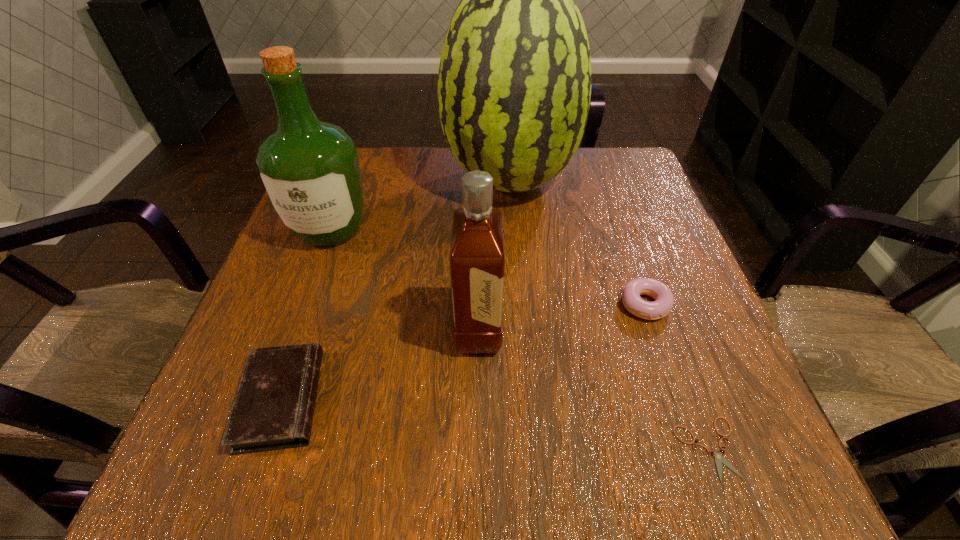
Locate an element on the screen. The image size is (960, 540). free space located 0.100m on the front label of the third tallest object is located at coordinates (555, 330).

I want to click on vacant space situated 0.050m on the right of the doughnut, so click(696, 305).

I want to click on vacant space located on the back of the diary, so pos(341,225).

You are a GUI agent. You are given a task and a screenshot of the screen. Output one action in this format:
    pyautogui.click(x=<x>, y=<y>)
    Task: Click on the free space located 0.150m on the left of the shears
    
    Given the screenshot: What is the action you would take?
    pyautogui.click(x=577, y=449)

You are a GUI agent. You are given a task and a screenshot of the screen. Output one action in this format:
    pyautogui.click(x=<x>, y=<y>)
    Task: Click on the object that is at the far edge
    
    Given the screenshot: What is the action you would take?
    pyautogui.click(x=514, y=83)

The height and width of the screenshot is (540, 960). In order to click on diary that is at the near edge in this screenshot , I will do `click(274, 405)`.

Locate an element on the screen. shears positioned at the near edge is located at coordinates (719, 459).

The image size is (960, 540). I want to click on liquor that is at the left edge, so click(x=310, y=169).

Identify the location of diary situated at the left edge. The height and width of the screenshot is (540, 960). (274, 405).

Locate an element on the screen. doughnut at the right edge is located at coordinates (664, 299).